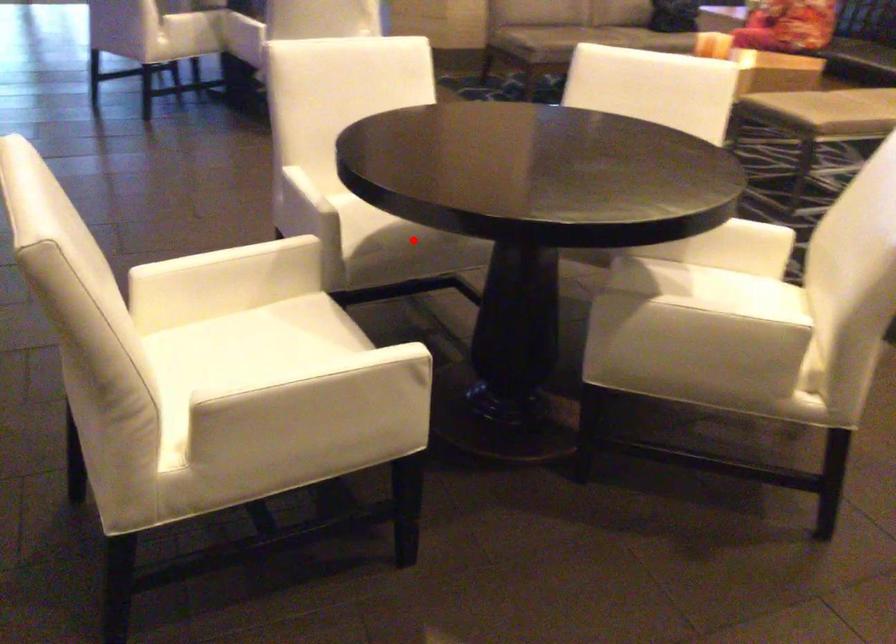
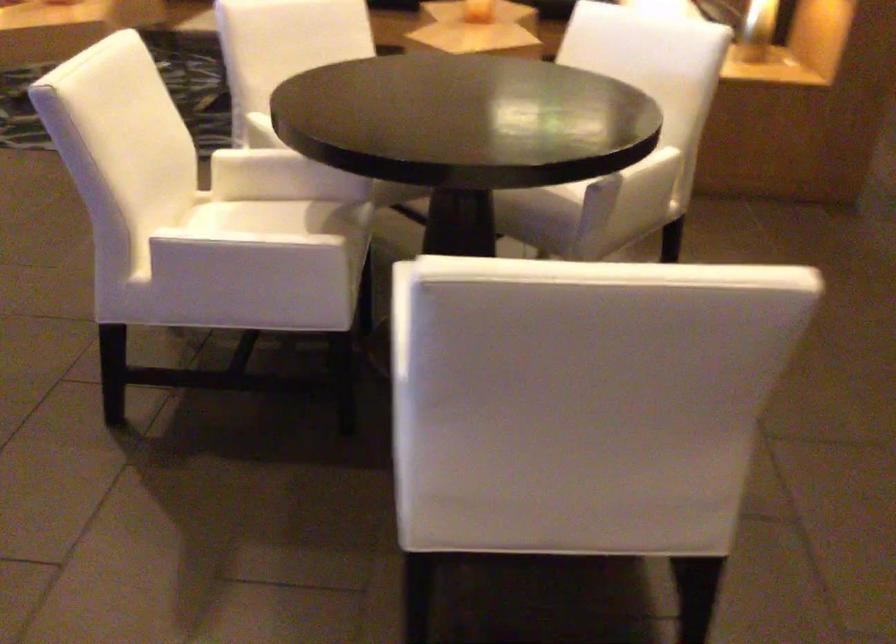
Locate, in the second image, the point that corresponds to the highlighted location in the first image.

(347, 240)